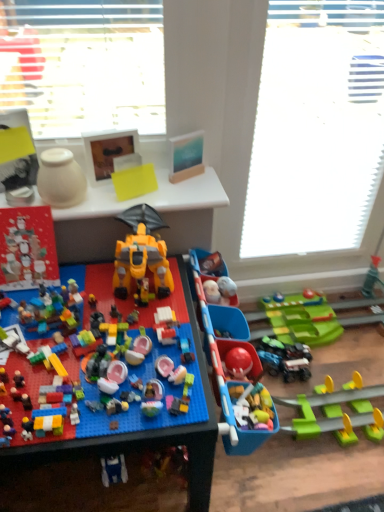
Question: From a real-world perspective, relative to white textured window screen at upper center, is yellow plastic robot at center, acting as the second toy starting from the right, vertically above or below?

Choices:
 (A) above
 (B) below

Answer: (B)

Question: Is yellow plastic robot at center, which appears as the 4th toy when viewed from the left, bigger or smaller than white textured window screen at upper center?

Choices:
 (A) small
 (B) big

Answer: (A)

Question: Considering the real-world distances, which object is farthest from the translucent plastic spaceship at center, arranged as the third toy when viewed from the right?

Choices:
 (A) yellow plastic table at upper center
 (B) white textured window screen at upper center
 (C) yellow plastic robot at center, acting as the second toy starting from the right
 (D) matte red advent calendar at left, the fifth toy when ordered from right to left
 (E) green plastic train at right, marked as the 1th toy in a right-to-left arrangement

Answer: (B)

Question: Estimate the real-world distances between objects in this image. Which object is farther from the yellow plastic table at upper center?

Choices:
 (A) yellow plastic robot at center, which appears as the 4th toy when viewed from the left
 (B) translucent plastic spaceship at center, arranged as the third toy when viewed from the right
 (C) matte red advent calendar at left, the fifth toy when ordered from right to left
 (D) green plastic train at right, the fifth toy in the left-to-right sequence
 (E) white matte vase at upper left, the second toy viewed from the left

Answer: (B)